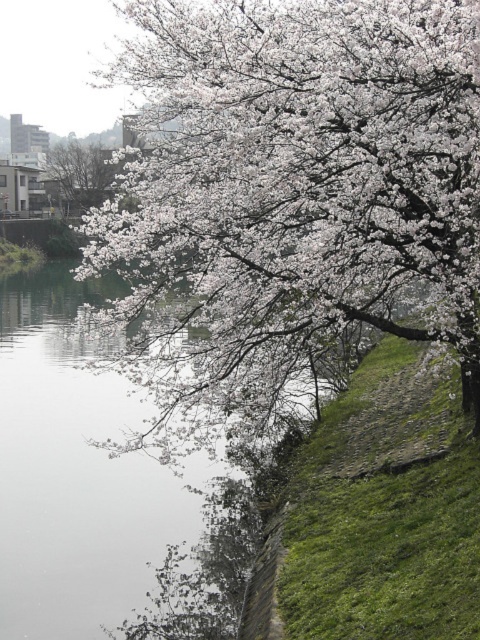
Describe the element at coordinates (288, 204) in the screenshot. This screenshot has width=480, height=640. I see `white matte blossoms at upper center` at that location.

Which is more to the left, white matte blossoms at upper center or white matte tree at upper center?

white matte tree at upper center is more to the left.

You are a GUI agent. You are given a task and a screenshot of the screen. Output one action in this format:
    pyautogui.click(x=<x>, y=<y>)
    Task: Click on the white matte blossoms at upper center
    Image resolution: width=480 pixels, height=640 pixels.
    Given the screenshot: What is the action you would take?
    pyautogui.click(x=288, y=204)